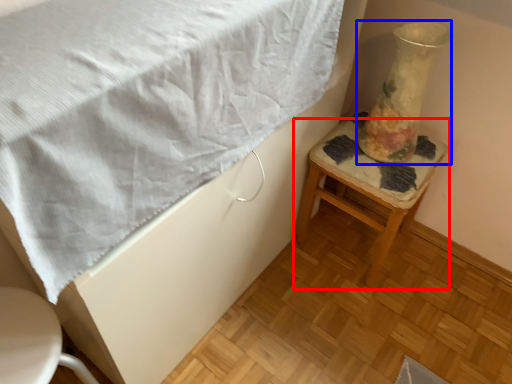
Question: Which object is closer to the camera taking this photo, stool (highlighted by a red box) or vase (highlighted by a blue box)?

Choices:
 (A) stool
 (B) vase

Answer: (B)